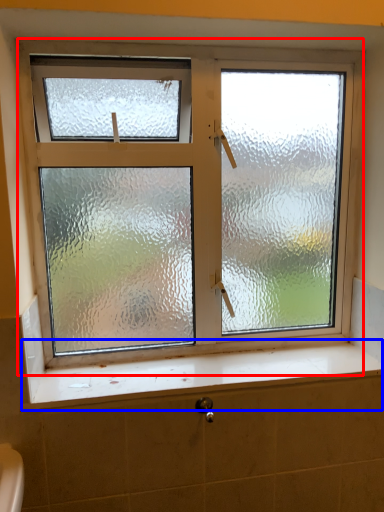
Question: Which point is closer to the camera, window (highlighted by a red box) or window sill (highlighted by a blue box)?

Choices:
 (A) window
 (B) window sill

Answer: (B)